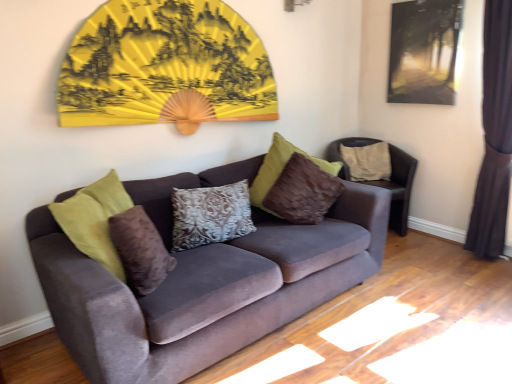
This screenshot has height=384, width=512. I want to click on free space in front of velvet brown chair at right, so click(415, 261).